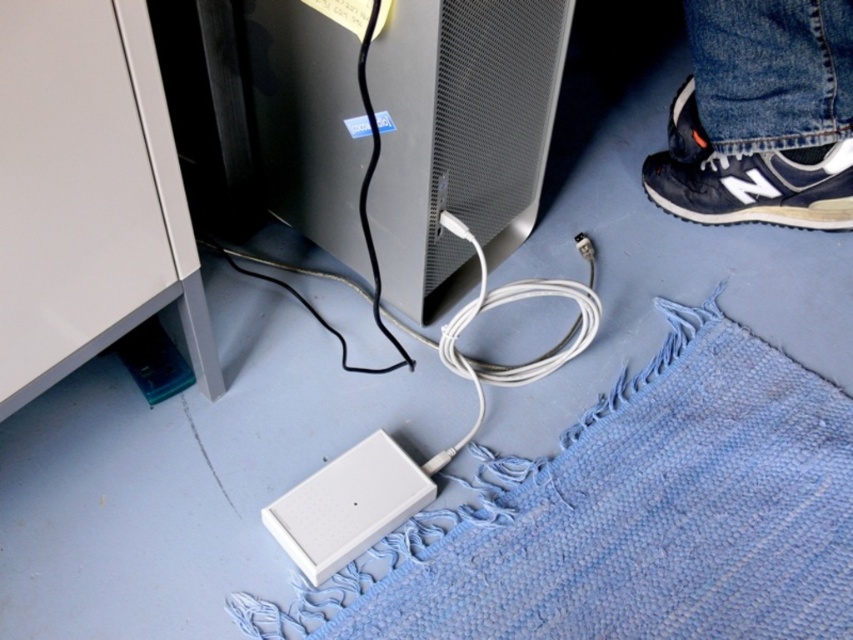
You are standing in the office and want to place a small plant between the two points marked as point (297,81) and point (828,65). Which point should the plant be closer to so it is in front of the other point?

The plant should be placed closer to point (297,81) because it is in front of point (828,65).